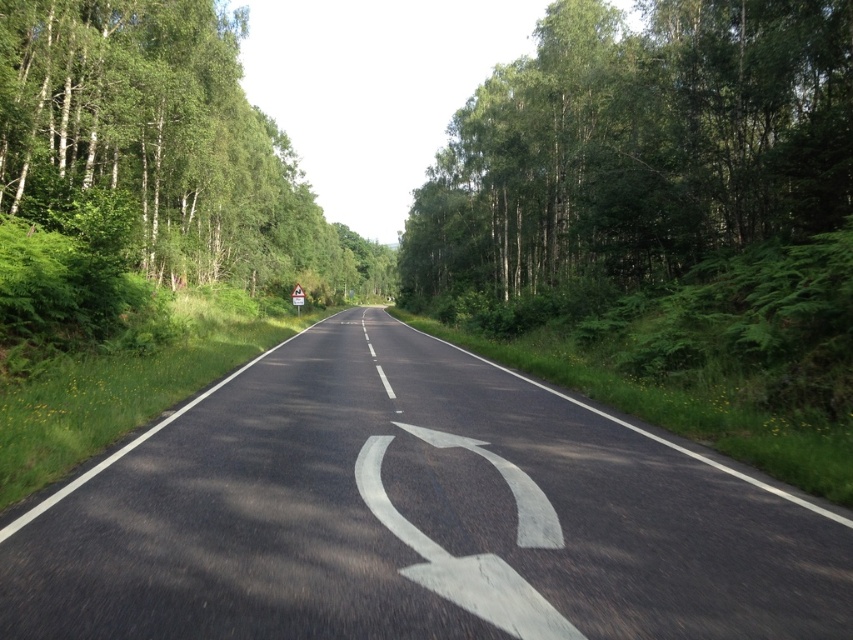
You are driving a car and approaching the road with green leafy trees at right and green leafy trees at left. Which side of the road has taller trees?

The green leafy trees at right are taller than the green leafy trees at left according to the description.

You are a driver approaching the black asphalt road at center and the green leafy trees at left. Which object appears taller from your viewpoint?

Result: The green leafy trees at left are taller than the black asphalt road at center, so they appear taller from your viewpoint.

You are driving a car that is 2 meters wide. You need to navigate through the white asphalt curve at center while avoiding the green leafy trees at right. Can your car safely pass through the curve without hitting the trees?

The green leafy trees at right are wider than the white asphalt curve at center. Since the car is 2 meters wide, it must fit within the curve. However, because the curve is narrower than the trees, there might not be enough space. Therefore, the car may not safely pass through without risking collision with the trees.